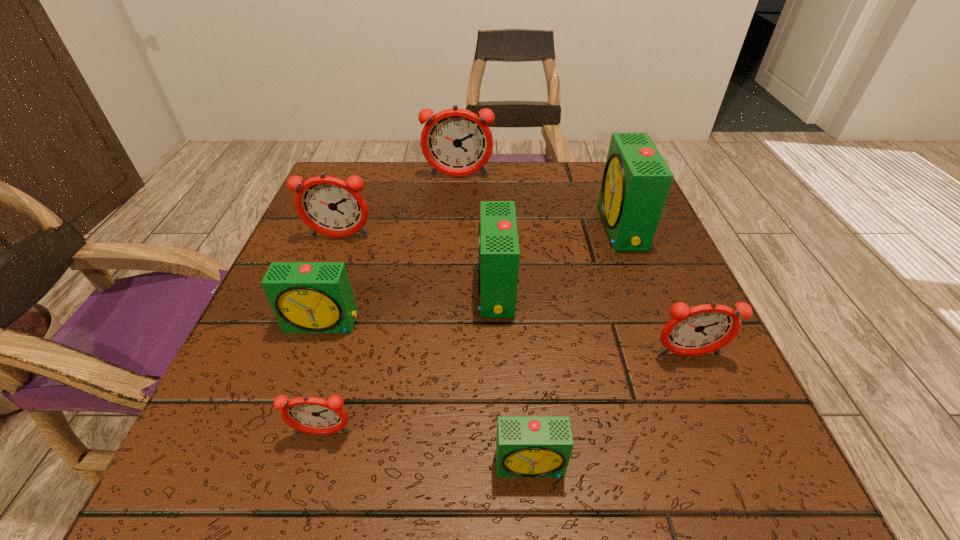
What are the coordinates of `vacant region that satisfies the following two spatial constraints: 1. on the front-facing side of the farthest green alarm clock; 2. on the front-facing side of the second nearest object` in the screenshot? It's located at (702, 433).

The image size is (960, 540). What are the coordinates of `vacant region that satisfies the following two spatial constraints: 1. on the front-facing side of the third smallest green alarm clock; 2. on the front-facing side of the second smallest green alarm clock` in the screenshot? It's located at (497, 323).

Locate an element on the screen. Image resolution: width=960 pixels, height=540 pixels. free space that satisfies the following two spatial constraints: 1. on the front-facing side of the rightmost green alarm clock; 2. on the front-facing side of the second farthest reddish-pink alarm clock is located at coordinates (625, 237).